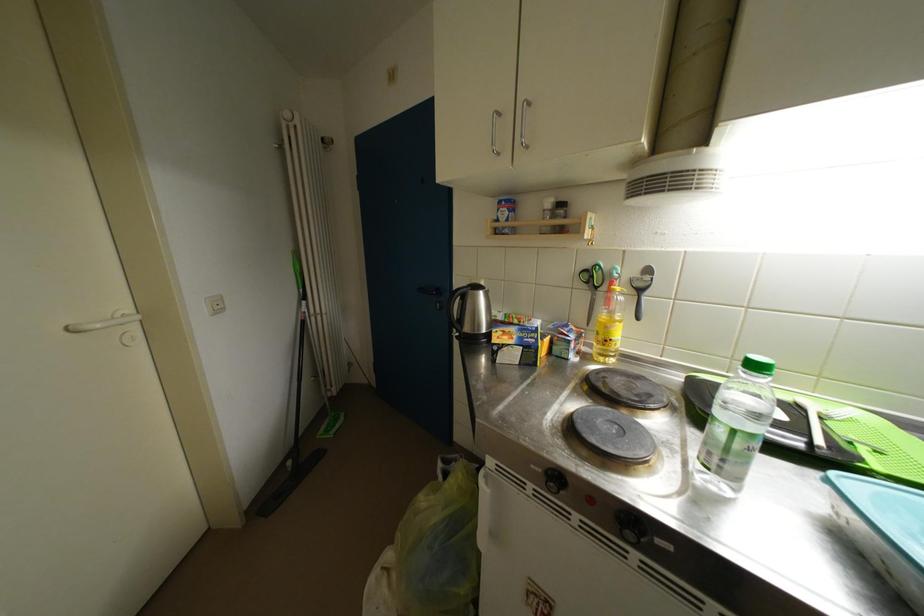
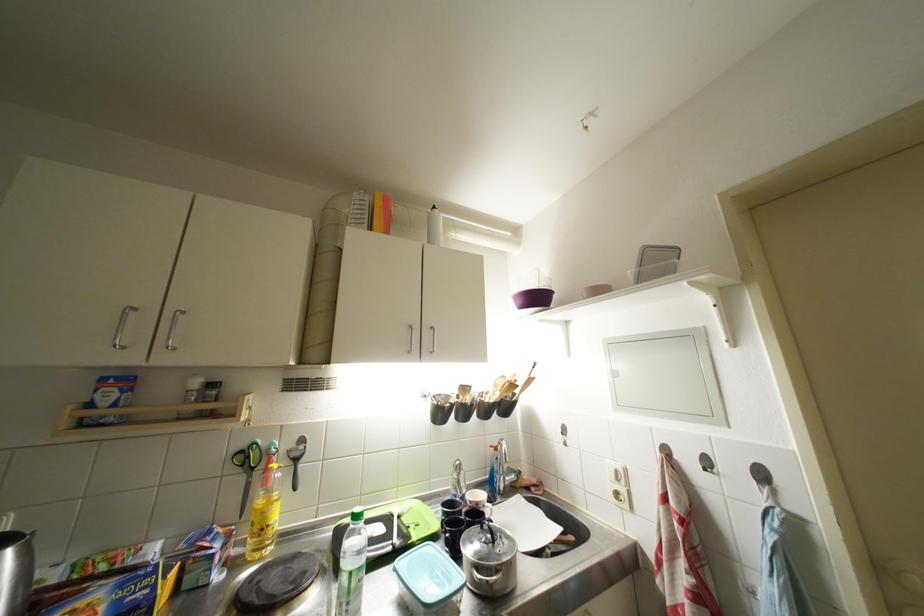
Find the pixel in the second image that matches the point at 835,485 in the first image.

(402, 573)